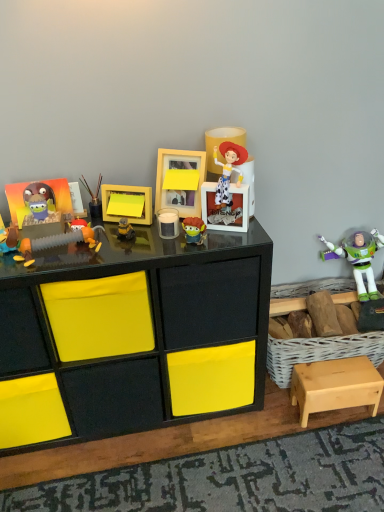
At what (x,y) coordinates should I click in order to perform the action: click on free space that is to the left of light wood step stool at lower right. Please return your answer as a coordinate pair (x, y). The width and height of the screenshot is (384, 512). Looking at the image, I should click on (278, 408).